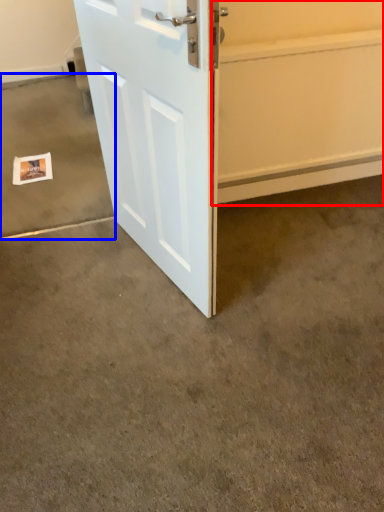
Question: Among these objects, which one is farthest to the camera, garage door (highlighted by a red box) or concrete (highlighted by a blue box)?

Choices:
 (A) garage door
 (B) concrete

Answer: (B)